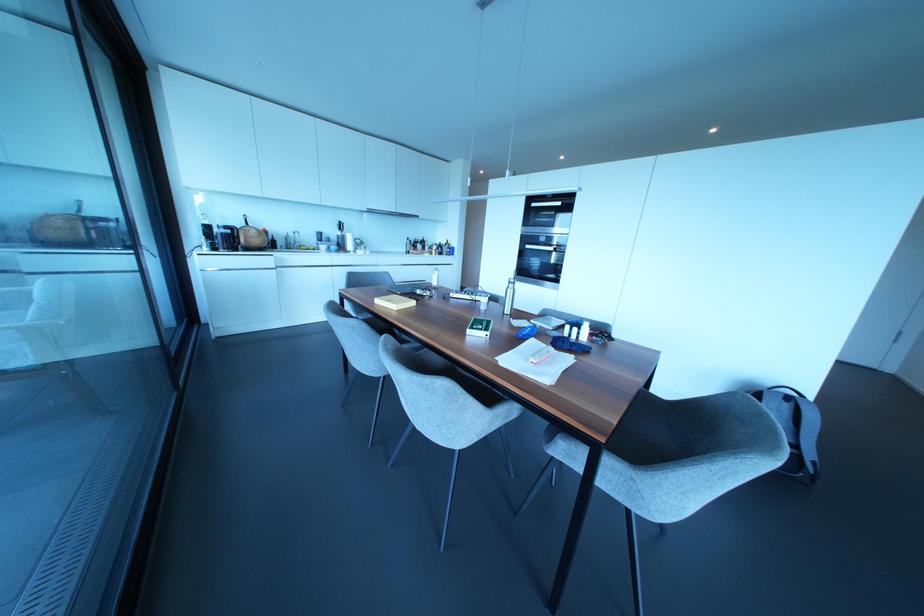
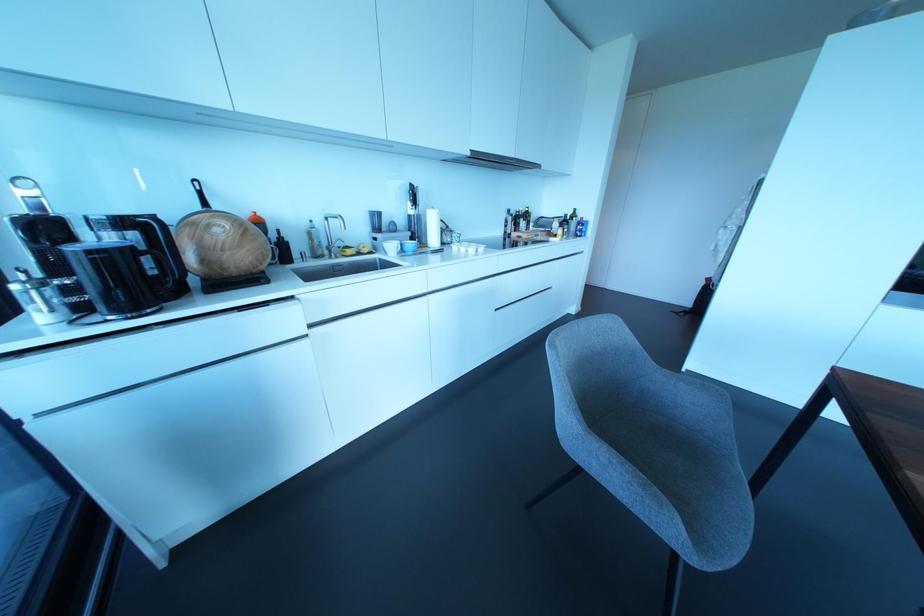
Find the pixel in the second image that matches (368,252) in the first image.

(480, 249)